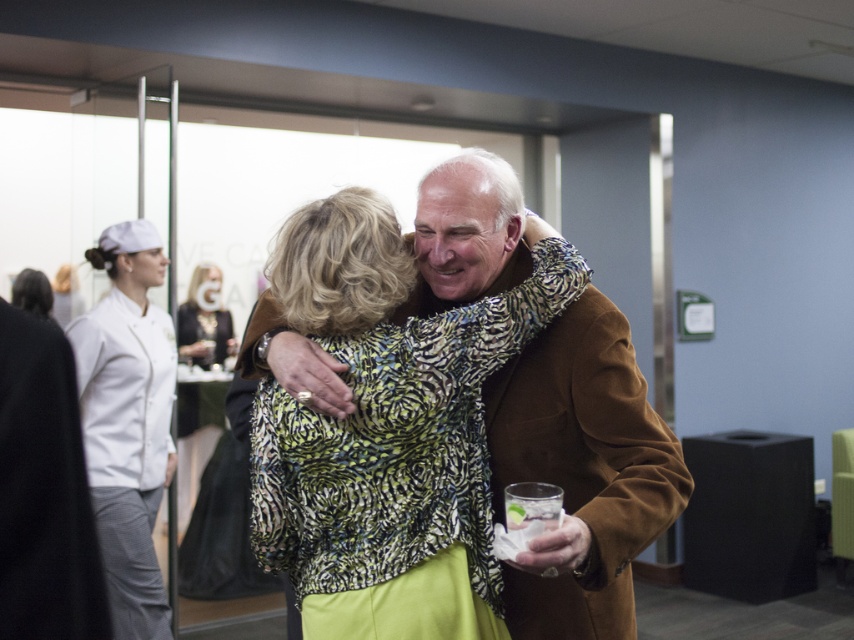
You are planning to take a photo of the two objects mentioned in the scene. Since both the brown wool coat at center and the black satin dress at center are at the center, how can you position your camera to ensure both are fully visible in the frame?

The brown wool coat at center is located above the black satin dress at center, so positioning the camera slightly above the dress will ensure both are fully visible in the frame.

You are standing in the conference room and want to reach the point marked at coordinates [174,464]. If you walk straight ahead, how far will you have to go to reach that point?

The point at coordinates [174,464] is 4.18 meters away from you, so you will have to walk 4.18 meters straight ahead to reach it.